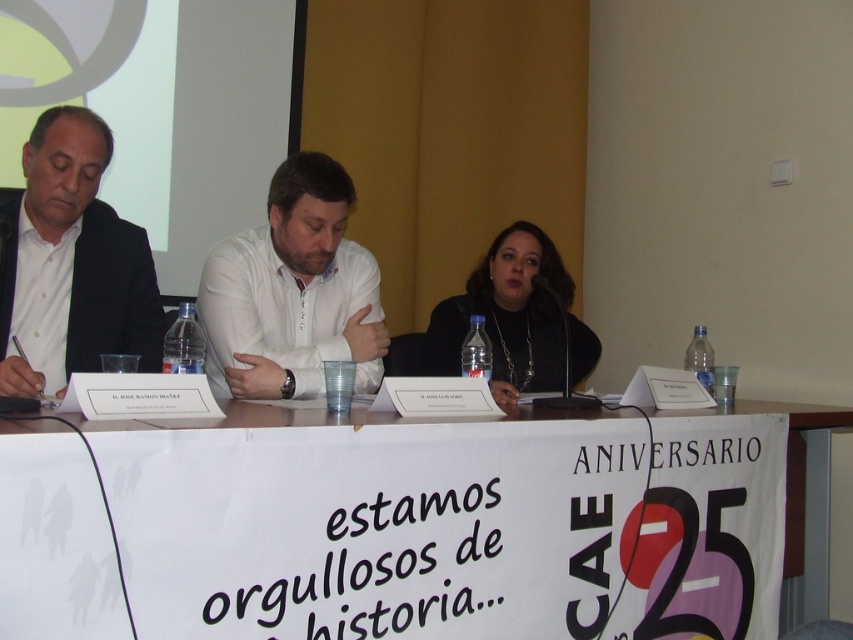
Question: Which object is the farthest from the matte black jacket at center?

Choices:
 (A) white paper banner at center
 (B) white shirt at center
 (C) white shirt at left

Answer: (C)

Question: Can you confirm if white shirt at center is wider than matte black jacket at center?

Choices:
 (A) yes
 (B) no

Answer: (B)

Question: Does white shirt at center have a larger size compared to matte black jacket at center?

Choices:
 (A) no
 (B) yes

Answer: (A)

Question: Which object appears farthest from the camera in this image?

Choices:
 (A) matte black jacket at center
 (B) white shirt at center
 (C) white shirt at left
 (D) white paper banner at center

Answer: (A)

Question: Which point is farther from the camera taking this photo?

Choices:
 (A) (514, 292)
 (B) (88, 195)
 (C) (352, 196)
 (D) (653, 552)

Answer: (A)

Question: Is the position of white shirt at left less distant than that of matte black jacket at center?

Choices:
 (A) no
 (B) yes

Answer: (B)